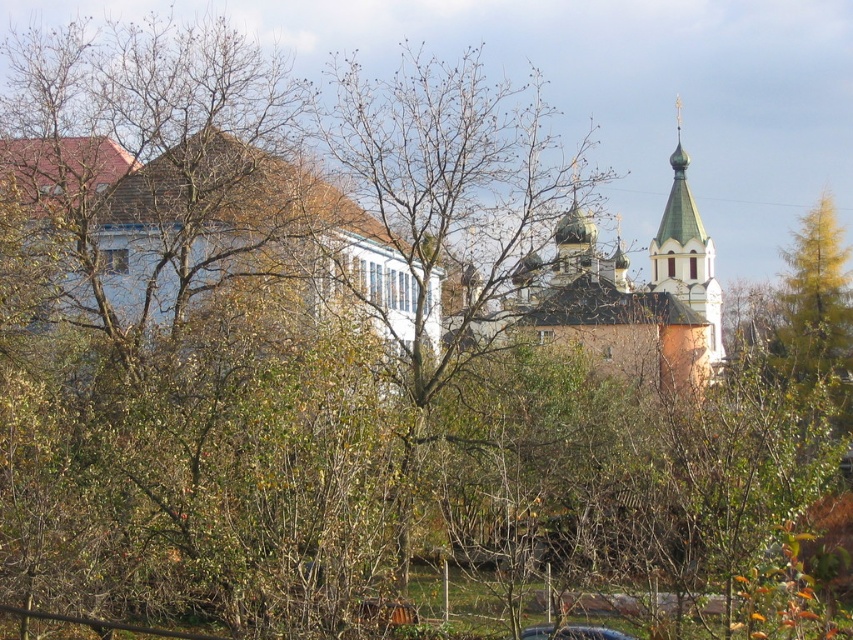
Which of these two, white matte building at left or green metallic church at upper right, stands taller?

With more height is green metallic church at upper right.

Is white matte building at left thinner than green metallic church at upper right?

Yes, white matte building at left is thinner than green metallic church at upper right.

The height and width of the screenshot is (640, 853). Identify the location of white matte building at left. (212, 234).

Locate an element on the screen. The image size is (853, 640). white matte building at left is located at coordinates (212, 234).

Does white matte building at left have a greater width compared to green painted wood tower at upper right?

Yes, white matte building at left is wider than green painted wood tower at upper right.

Describe the element at coordinates (212, 234) in the screenshot. I see `white matte building at left` at that location.

Locate an element on the screen. The image size is (853, 640). white matte building at left is located at coordinates (212, 234).

The height and width of the screenshot is (640, 853). What are the coordinates of `white matte building at left` in the screenshot? It's located at (212, 234).

Based on the photo, which is below, green metallic church at upper right or green painted wood tower at upper right?

green painted wood tower at upper right is lower down.

This screenshot has height=640, width=853. What do you see at coordinates (625, 294) in the screenshot?
I see `green metallic church at upper right` at bounding box center [625, 294].

Locate an element on the screen. This screenshot has width=853, height=640. green metallic church at upper right is located at coordinates (625, 294).